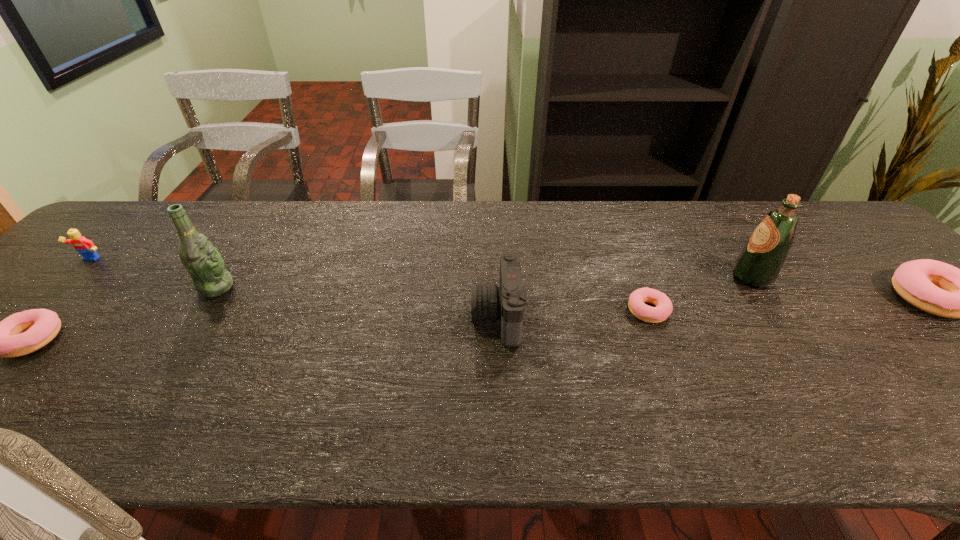
Locate an element on the screen. Image resolution: width=960 pixels, height=540 pixels. the second doughnut from right to left is located at coordinates (638, 298).

This screenshot has height=540, width=960. I want to click on the shortest doughnut, so click(638, 298).

Where is `the fourth shortest object`? the fourth shortest object is located at coordinates (85, 247).

Where is `olive oil`? The width and height of the screenshot is (960, 540). olive oil is located at coordinates (759, 263).

Locate an element on the screen. the third object from left to right is located at coordinates (206, 267).

This screenshot has width=960, height=540. Find the location of `the fourth object from right to left`. the fourth object from right to left is located at coordinates (506, 302).

Locate an element on the screen. The width and height of the screenshot is (960, 540). the third tallest object is located at coordinates (506, 302).

Locate an element on the screen. Image resolution: width=960 pixels, height=540 pixels. vacant area located on the right of the shortest doughnut is located at coordinates (753, 310).

The image size is (960, 540). What are the coordinates of `free point located on the face of the Lego` in the screenshot? It's located at (48, 302).

Image resolution: width=960 pixels, height=540 pixels. Identify the location of blank space located on the front-facing side of the olive oil. (590, 277).